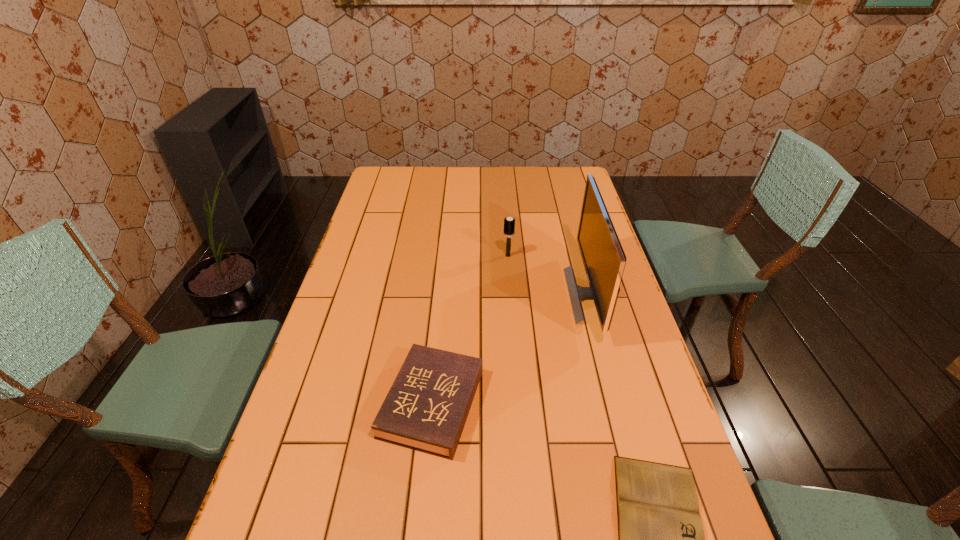
You are a GUI agent. You are given a task and a screenshot of the screen. Output one action in this format:
    pyautogui.click(x=<x>, y=<y>)
    Task: Click on the monitor
    
    Given the screenshot: What is the action you would take?
    pyautogui.click(x=604, y=260)

Locate an element on the screen. The width and height of the screenshot is (960, 540). the third object from right to left is located at coordinates (509, 222).

I want to click on hairbrush, so click(x=509, y=222).

Locate an element on the screen. hardback book is located at coordinates click(x=426, y=408).

This screenshot has height=540, width=960. I want to click on the leftmost object, so point(426,408).

Locate an element on the screen. The image size is (960, 540). vacant region located on the screen side of the monitor is located at coordinates coord(506,295).

The width and height of the screenshot is (960, 540). Identify the location of free space located 0.330m on the screen side of the monitor. pyautogui.click(x=465, y=295).

At what (x,y) coordinates should I click in order to perform the action: click on vacant space located on the screen side of the monitor. Please return your answer as a coordinate pair (x, y). The image size is (960, 540). Looking at the image, I should click on (493, 295).

Find the location of a particular element. This screenshot has height=540, width=960. free space located 0.310m on the back of the hairbrush is located at coordinates (504, 205).

The height and width of the screenshot is (540, 960). What are the coordinates of `free region located 0.090m on the front of the hardback book` in the screenshot? It's located at click(x=422, y=502).